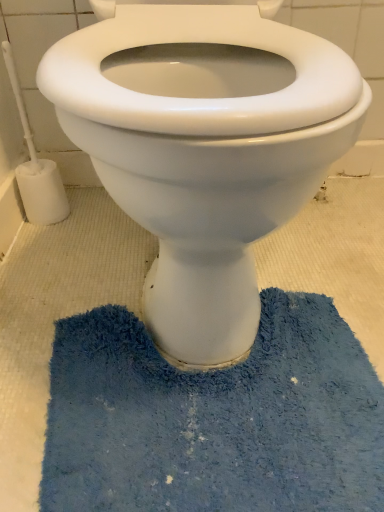
Question: Is point (150, 445) closer or farther from the camera than point (62, 194)?

Choices:
 (A) closer
 (B) farther

Answer: (A)

Question: From a real-world perspective, relative to white plastic toilet brush at left, is blue shaggy bath mat at lower center vertically above or below?

Choices:
 (A) above
 (B) below

Answer: (B)

Question: Estimate the real-world distances between objects in this image. Which object is closer to the blue shaggy bath mat at lower center?

Choices:
 (A) white plastic toilet brush at left
 (B) white glossy toilet at center

Answer: (B)

Question: Considering the real-world distances, which object is farthest from the blue shaggy bath mat at lower center?

Choices:
 (A) white plastic toilet brush at left
 (B) white glossy toilet at center

Answer: (A)